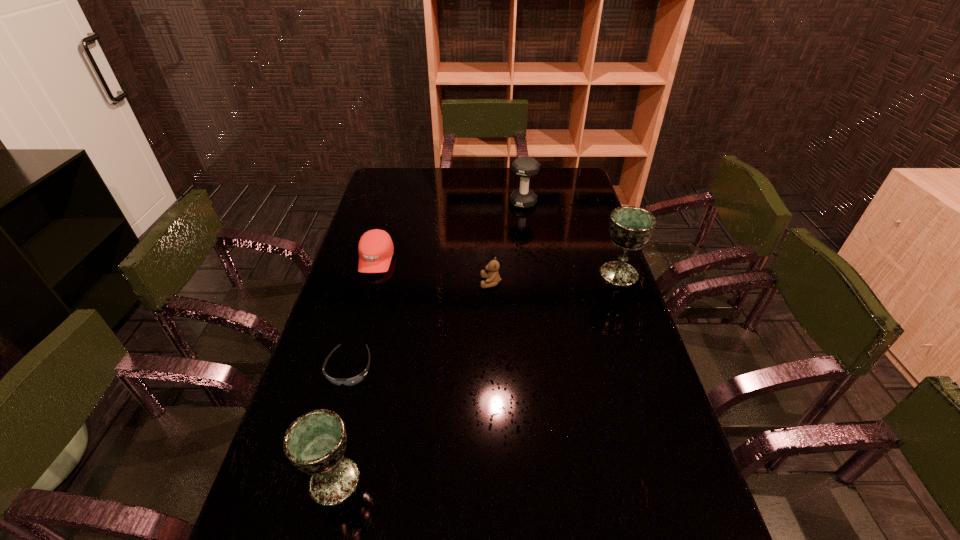
Find the location of a particular element. The height and width of the screenshot is (540, 960). vacant area situated on the right of the nearer chalice is located at coordinates (457, 481).

Where is `blank space located on the left of the taller chalice`? blank space located on the left of the taller chalice is located at coordinates (565, 274).

The width and height of the screenshot is (960, 540). I want to click on vacant space located 0.260m on the front-facing side of the cap, so tap(354, 336).

Where is `vacant space located on the left of the dumbbell`? This screenshot has width=960, height=540. vacant space located on the left of the dumbbell is located at coordinates (451, 203).

Where is `vacant space located on the lenses of the second nearest object`? The width and height of the screenshot is (960, 540). vacant space located on the lenses of the second nearest object is located at coordinates (318, 483).

Where is `vacant region located 0.350m on the front-facing side of the fourth object from left to right`? The height and width of the screenshot is (540, 960). vacant region located 0.350m on the front-facing side of the fourth object from left to right is located at coordinates (374, 282).

At what (x,y) coordinates should I click in order to perform the action: click on free space located 0.240m on the front-facing side of the fourth object from left to right. Please return your answer as a coordinate pair (x, y). The image size is (960, 540). Looking at the image, I should click on (407, 282).

Identify the location of vacant region located on the front-facing side of the fourth object from left to right. The height and width of the screenshot is (540, 960). (396, 282).

The width and height of the screenshot is (960, 540). I want to click on object situated at the near edge, so click(x=315, y=443).

You are a GUI agent. You are given a task and a screenshot of the screen. Output one action in this format:
    pyautogui.click(x=<x>, y=<y>)
    Task: Click on the chalice at the left edge
    
    Given the screenshot: What is the action you would take?
    pyautogui.click(x=315, y=443)